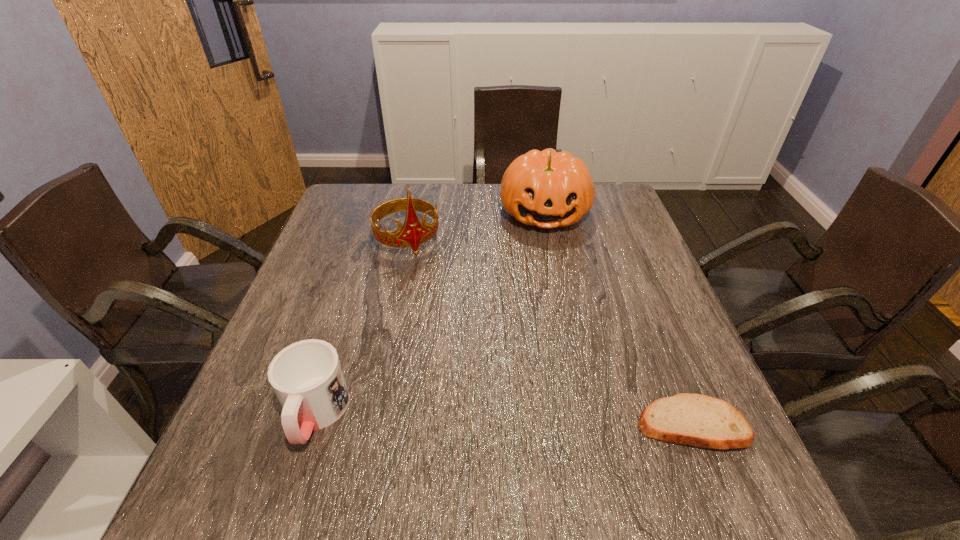
This screenshot has height=540, width=960. I want to click on free location located 0.360m on the carved face of the pumpkin, so click(553, 333).

At what (x,y) coordinates should I click in order to perform the action: click on tiara that is at the far edge. Please return your answer as a coordinate pair (x, y). Image resolution: width=960 pixels, height=540 pixels. Looking at the image, I should click on (413, 233).

At what (x,y) coordinates should I click in order to perform the action: click on pumpkin at the far edge. Please return your answer as a coordinate pair (x, y). The image size is (960, 540). Looking at the image, I should click on (549, 189).

Identify the location of mug located in the near edge section of the desktop. (307, 378).

Locate an element on the screen. pita bread situated at the near edge is located at coordinates (692, 419).

Locate an element on the screen. The width and height of the screenshot is (960, 540). mug situated at the left edge is located at coordinates (307, 378).

This screenshot has width=960, height=540. What are the coordinates of `tiara present at the left edge` in the screenshot? It's located at (413, 233).

Where is `pita bread at the right edge`? Image resolution: width=960 pixels, height=540 pixels. pita bread at the right edge is located at coordinates (692, 419).

The height and width of the screenshot is (540, 960). What are the coordinates of `pumpkin present at the right edge` in the screenshot? It's located at (549, 189).

Where is `object at the far left corner`? The width and height of the screenshot is (960, 540). object at the far left corner is located at coordinates (413, 233).